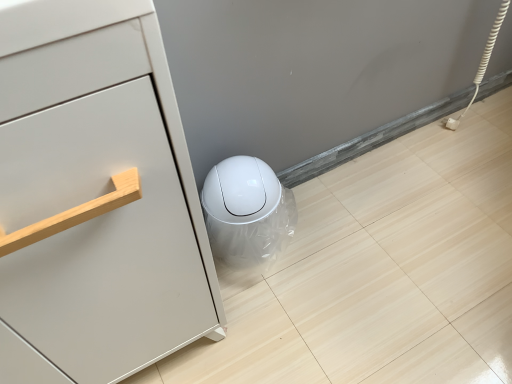
Question: Does white glossy trash can at lower center appear on the right side of matte white cabinet at left?

Choices:
 (A) yes
 (B) no

Answer: (A)

Question: Can you confirm if white glossy trash can at lower center is shorter than matte white cabinet at left?

Choices:
 (A) yes
 (B) no

Answer: (A)

Question: Considering the relative sizes of white glossy trash can at lower center and matte white cabinet at left in the image provided, is white glossy trash can at lower center wider than matte white cabinet at left?

Choices:
 (A) yes
 (B) no

Answer: (B)

Question: From the image's perspective, does white glossy trash can at lower center appear higher than matte white cabinet at left?

Choices:
 (A) yes
 (B) no

Answer: (A)

Question: From the image's perspective, does white glossy trash can at lower center appear lower than matte white cabinet at left?

Choices:
 (A) no
 (B) yes

Answer: (A)

Question: Does white glossy trash can at lower center appear on the left side of matte white cabinet at left?

Choices:
 (A) yes
 (B) no

Answer: (B)

Question: Is matte white cabinet at left outside white glossy trash can at lower center?

Choices:
 (A) yes
 (B) no

Answer: (A)

Question: Is matte white cabinet at left not near white glossy trash can at lower center?

Choices:
 (A) yes
 (B) no

Answer: (B)

Question: From a real-world perspective, is matte white cabinet at left beneath white glossy trash can at lower center?

Choices:
 (A) yes
 (B) no

Answer: (B)

Question: Is matte white cabinet at left smaller than white glossy trash can at lower center?

Choices:
 (A) no
 (B) yes

Answer: (A)

Question: Considering the relative sizes of matte white cabinet at left and white glossy trash can at lower center in the image provided, is matte white cabinet at left bigger than white glossy trash can at lower center?

Choices:
 (A) no
 (B) yes

Answer: (B)

Question: Is matte white cabinet at left oriented towards white glossy trash can at lower center?

Choices:
 (A) no
 (B) yes

Answer: (A)

Question: From the image's perspective, is matte white cabinet at left positioned above or below white glossy trash can at lower center?

Choices:
 (A) above
 (B) below

Answer: (B)